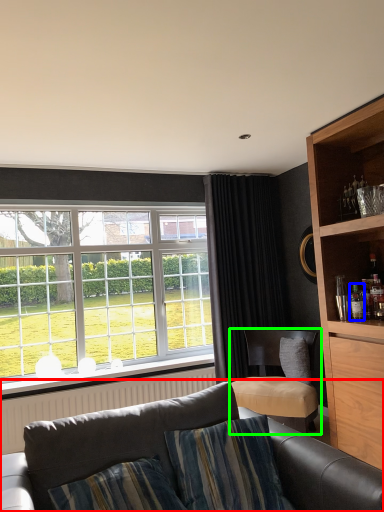
Question: Estimate the real-world distances between objects in this image. Which object is farther from studio couch (highlighted by a red box), bottle (highlighted by a blue box) or chair (highlighted by a green box)?

Choices:
 (A) bottle
 (B) chair

Answer: (A)